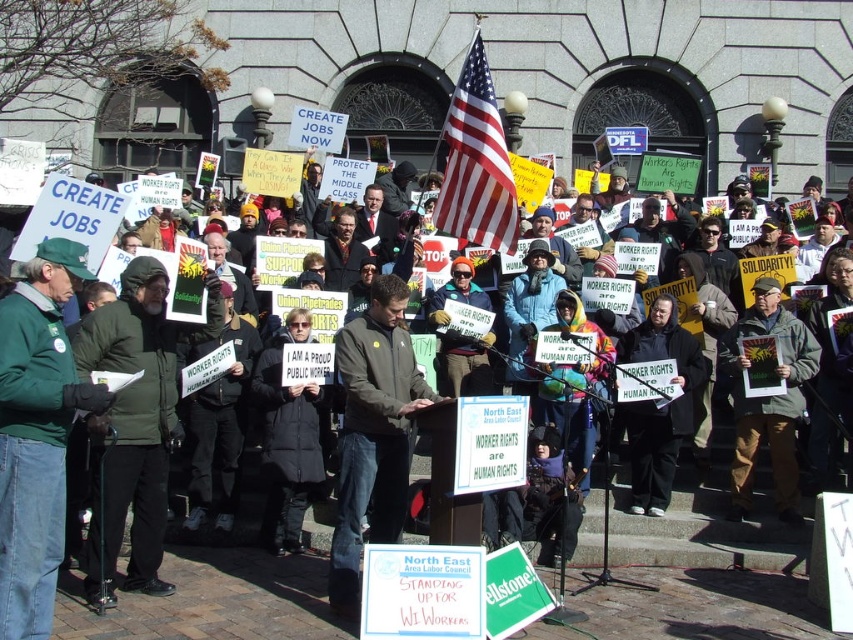
In the scene shown: You are a photographer at the rally and want to capture both the green fabric jacket at left and the orange knit hat at center in a single shot. Which object should you frame first to ensure both are visible?

The green fabric jacket at left should be framed first since it is positioned on the left side of the orange knit hat at center, allowing both to be included in the shot.